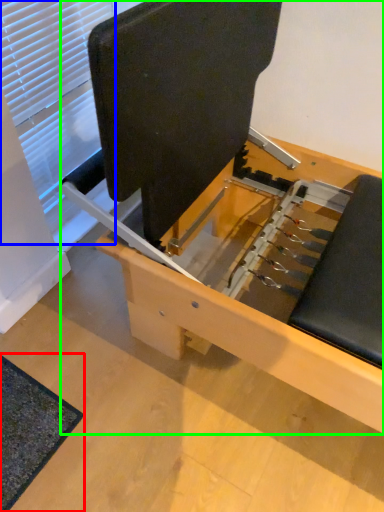
Question: Which object is the farthest from mat (highlighted by a red box)? Choose among these: window (highlighted by a blue box) or furniture (highlighted by a green box).

Choices:
 (A) window
 (B) furniture

Answer: (A)